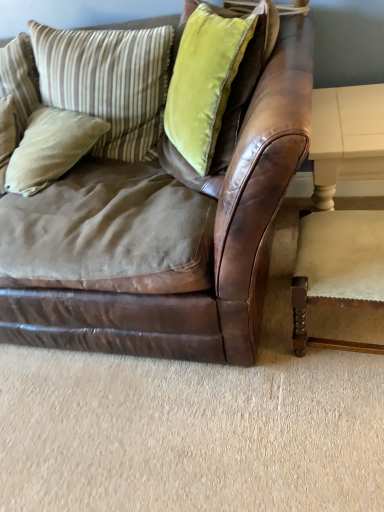
Question: Is striped fabric pillow at upper left, which is counted as the 1th pillow, starting from the left, at the back of striped fabric pillow at upper left, which ranks as the 2th pillow in right-to-left order?

Choices:
 (A) no
 (B) yes

Answer: (A)

Question: Is striped fabric pillow at upper left, which ranks as the 2th pillow in right-to-left order, closer to the viewer compared to striped fabric pillow at upper left, which is counted as the 1th pillow, starting from the left?

Choices:
 (A) yes
 (B) no

Answer: (A)

Question: Can you confirm if striped fabric pillow at upper left, acting as the third pillow starting from the left, is positioned to the right of striped fabric pillow at upper left, which is counted as the 1th pillow, starting from the left?

Choices:
 (A) no
 (B) yes

Answer: (B)

Question: From the image's perspective, is striped fabric pillow at upper left, which ranks as the 2th pillow in right-to-left order, on top of striped fabric pillow at upper left, which is counted as the 1th pillow, starting from the left?

Choices:
 (A) no
 (B) yes

Answer: (A)

Question: Does striped fabric pillow at upper left, acting as the third pillow starting from the left, contain striped fabric pillow at upper left, which is counted as the 1th pillow, starting from the left?

Choices:
 (A) no
 (B) yes

Answer: (A)

Question: Is beige cotton pillow at left, the 2th pillow viewed from the left, in front of or behind white painted wood table at right in the image?

Choices:
 (A) behind
 (B) front

Answer: (A)

Question: Considering the positions of point (61, 121) and point (322, 206), is point (61, 121) closer or farther from the camera than point (322, 206)?

Choices:
 (A) closer
 (B) farther

Answer: (B)

Question: In terms of width, does beige cotton pillow at left, the 2th pillow viewed from the left, look wider or thinner when compared to white painted wood table at right?

Choices:
 (A) wide
 (B) thin

Answer: (B)

Question: Do you think beige cotton pillow at left, the 2th pillow viewed from the left, is within white painted wood table at right, or outside of it?

Choices:
 (A) inside
 (B) outside

Answer: (B)

Question: From the image's perspective, is white painted wood table at right above or below beige cotton pillow at left, the 2th pillow viewed from the left?

Choices:
 (A) below
 (B) above

Answer: (A)

Question: Would you say white painted wood table at right is to the left or to the right of beige cotton pillow at left, which is counted as the third pillow, starting from the right, in the picture?

Choices:
 (A) right
 (B) left

Answer: (A)

Question: Considering their positions, is white painted wood table at right located in front of or behind beige cotton pillow at left, which is counted as the third pillow, starting from the right?

Choices:
 (A) front
 (B) behind

Answer: (A)

Question: Is white painted wood table at right spatially inside beige cotton pillow at left, the 2th pillow viewed from the left, or outside of it?

Choices:
 (A) outside
 (B) inside

Answer: (A)

Question: From a real-world perspective, relative to brown leather couch at center, is white painted wood table at right vertically above or below?

Choices:
 (A) below
 (B) above

Answer: (A)

Question: Does point (347, 176) appear closer or farther from the camera than point (183, 291)?

Choices:
 (A) closer
 (B) farther

Answer: (B)